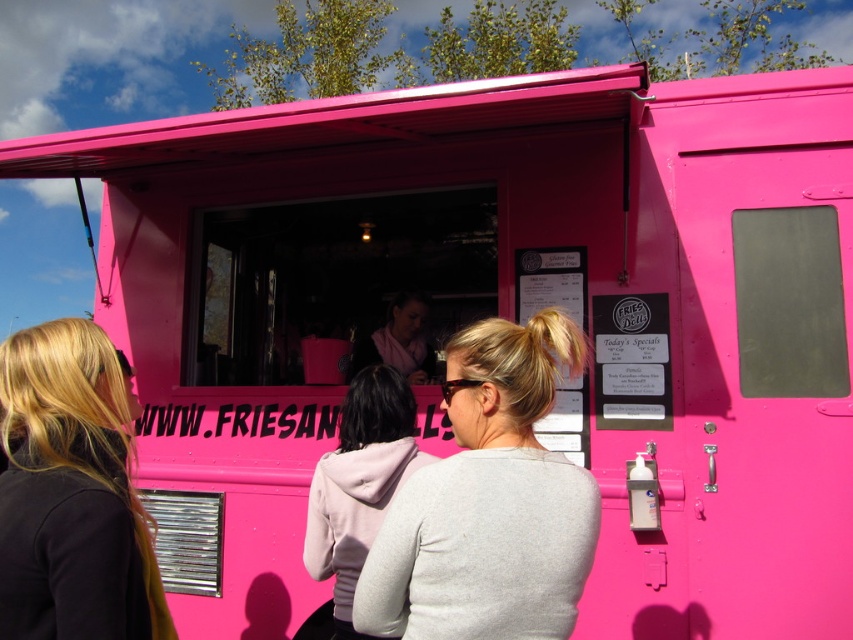
You are a customer looking at the food truck and notice two items on the menu board. One is labeled as black matte hair at left and the other as pink fleece hoodie at center. Which menu item takes up more space on the board?

The pink fleece hoodie at center takes up more space on the board because it is larger than the black matte hair at left.

You are trying to decide between two items displayed in a store window. The items are the matte gray sweater at center and the pink fleece hoodie at center. Which item is larger?

The pink fleece hoodie at center is larger than the matte gray sweater at center.

You are trying to decide which item to grab first from the trunk of the pink food truck. You see both the matte gray sweater at center and the pink fleece hoodie at center. If you want to pick up the item that is closer to you, which one should you choose?

The matte gray sweater at center is 68.49 centimeters away from the pink fleece hoodie at center. Since you want the closer item, you need to determine which one is nearer. However, the description only provides the distance between them, not their positions relative to you. Without knowing their exact locations from your viewpoint, it is impossible to determine which is closer.